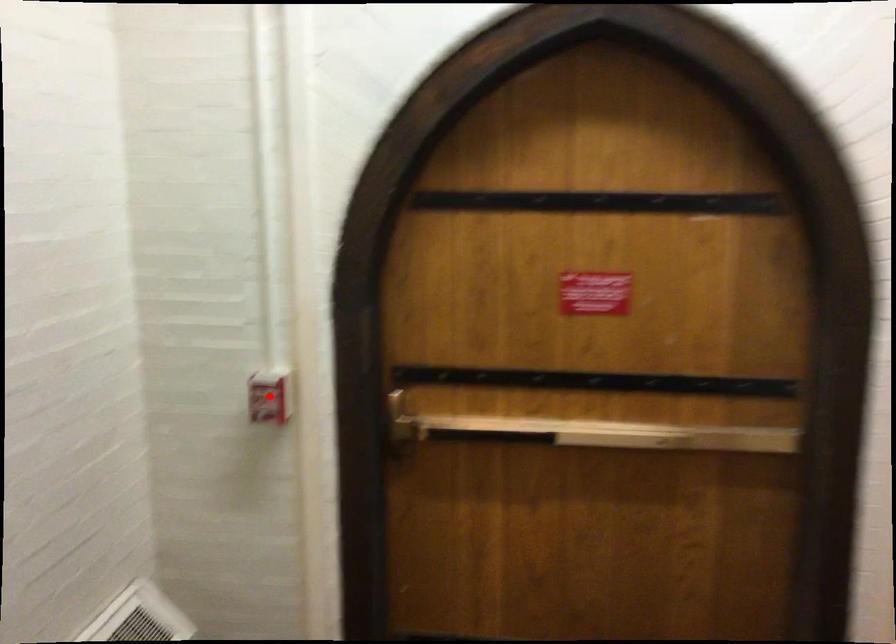
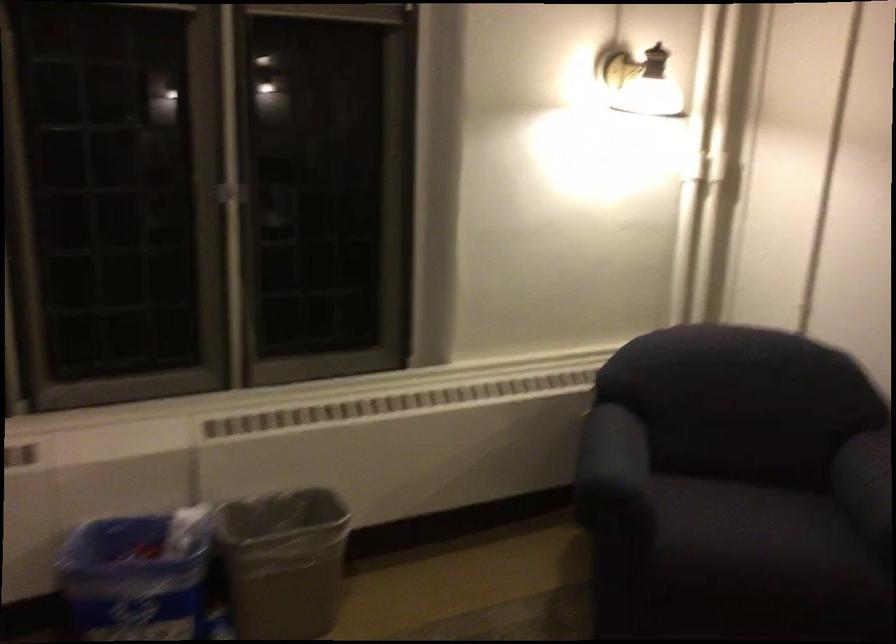
Question: I am providing you with two images of the same scene from different viewpoints. A red point is marked on the first image. Is the red point's position out of view in image 2?

Choices:
 (A) Yes
 (B) No

Answer: (A)